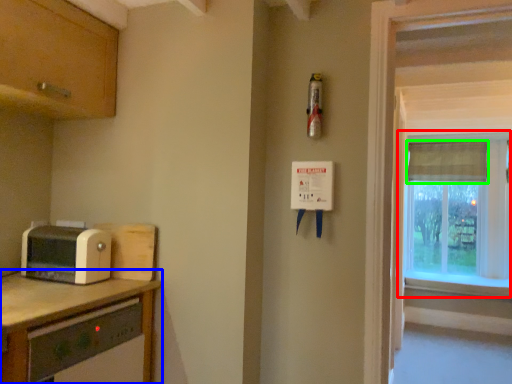
Question: Which object is positioned closest to window (highlighted by a red box)? Select from countertop (highlighted by a blue box) and curtain (highlighted by a green box).

Choices:
 (A) countertop
 (B) curtain

Answer: (B)